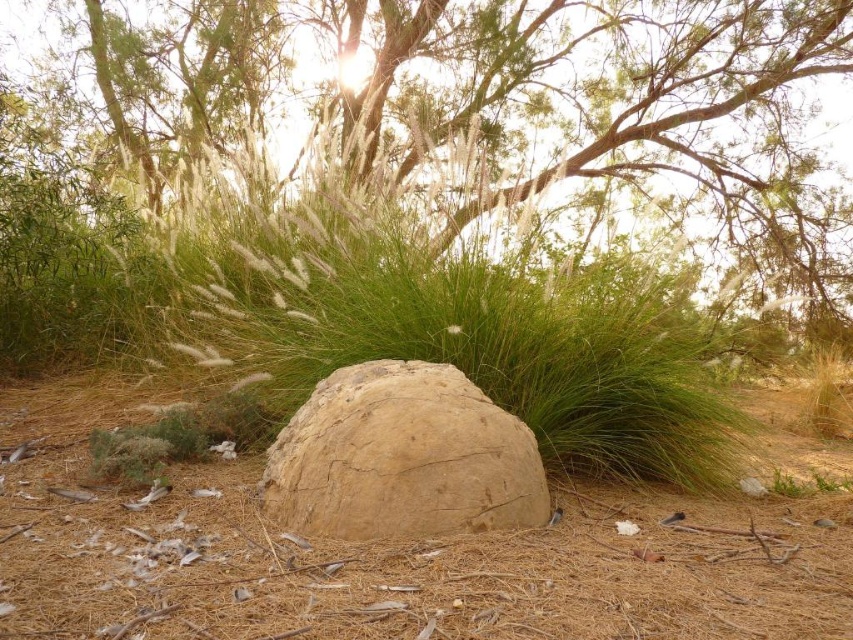
Question: Which point is closer to the camera taking this photo?

Choices:
 (A) (57, 109)
 (B) (643, 365)
 (C) (538, 506)

Answer: (C)

Question: Does green leafy tree at upper center have a smaller size compared to brown rough boulder at center?

Choices:
 (A) no
 (B) yes

Answer: (A)

Question: Among these objects, which one is nearest to the camera?

Choices:
 (A) green grass at center
 (B) green leafy tree at upper center

Answer: (B)

Question: Which point is closer to the camera?

Choices:
 (A) green leafy tree at upper center
 (B) brown rough boulder at center
 (C) green grass at center

Answer: (B)

Question: Can you confirm if green leafy tree at upper center is thinner than green grass at center?

Choices:
 (A) yes
 (B) no

Answer: (B)

Question: Is green grass at center bigger than brown rough boulder at center?

Choices:
 (A) no
 (B) yes

Answer: (A)